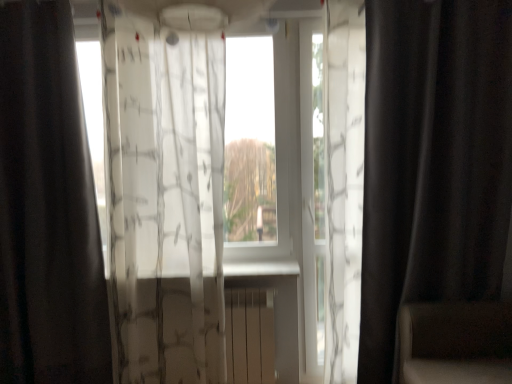
Question: Which direction should I rotate to look at translucent white curtain at center, the second curtain in the right-to-left sequence, — up or down?

Choices:
 (A) up
 (B) down

Answer: (B)

Question: Does transparent fabric at center have a larger size compared to dark brown leather armchair at right?

Choices:
 (A) yes
 (B) no

Answer: (B)

Question: Is transparent fabric at center aimed at dark brown leather armchair at right?

Choices:
 (A) yes
 (B) no

Answer: (B)

Question: Considering the relative sizes of transparent fabric at center and dark brown leather armchair at right in the image provided, is transparent fabric at center thinner than dark brown leather armchair at right?

Choices:
 (A) yes
 (B) no

Answer: (A)

Question: Can you confirm if transparent fabric at center is shorter than dark brown leather armchair at right?

Choices:
 (A) yes
 (B) no

Answer: (B)

Question: From a real-world perspective, is transparent fabric at center positioned under dark brown leather armchair at right based on gravity?

Choices:
 (A) no
 (B) yes

Answer: (A)

Question: Can you confirm if transparent fabric at center is smaller than dark brown leather armchair at right?

Choices:
 (A) no
 (B) yes

Answer: (B)

Question: Does matte beige radiator at center have a greater width compared to transparent fabric at center?

Choices:
 (A) yes
 (B) no

Answer: (B)

Question: Can you confirm if matte beige radiator at center is thinner than transparent fabric at center?

Choices:
 (A) no
 (B) yes

Answer: (B)

Question: Can you confirm if matte beige radiator at center is shorter than transparent fabric at center?

Choices:
 (A) no
 (B) yes

Answer: (B)

Question: Is the depth of matte beige radiator at center less than that of transparent fabric at center?

Choices:
 (A) yes
 (B) no

Answer: (B)

Question: Does matte beige radiator at center have a larger size compared to transparent fabric at center?

Choices:
 (A) yes
 (B) no

Answer: (B)

Question: Is matte beige radiator at center directly adjacent to transparent fabric at center?

Choices:
 (A) yes
 (B) no

Answer: (B)

Question: From the image's perspective, does black matte curtain at right, which is the third curtain in left-to-right order, appear lower than transparent fabric at center?

Choices:
 (A) yes
 (B) no

Answer: (A)